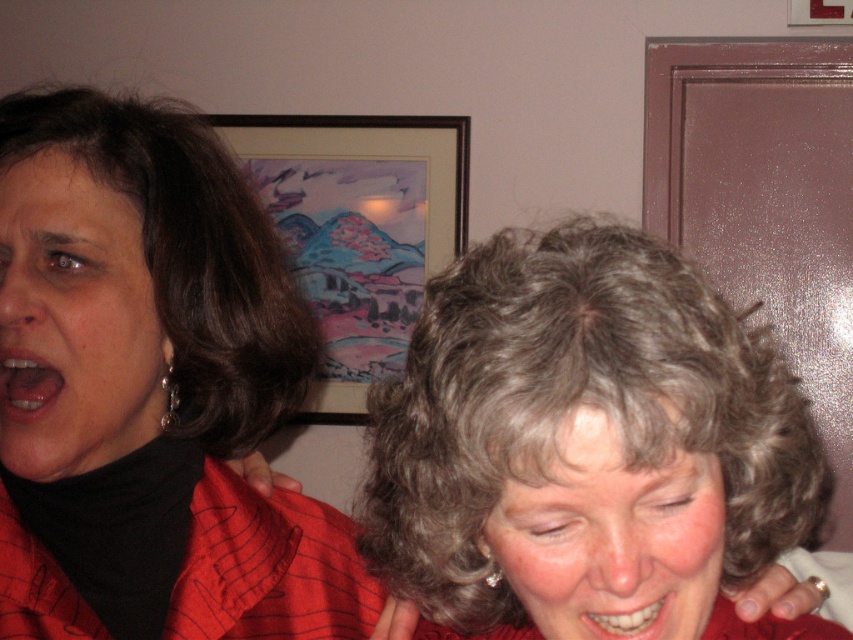
Question: Is gray curly hair at center below wooden framed artwork at upper center?

Choices:
 (A) yes
 (B) no

Answer: (A)

Question: Which object appears farthest from the camera in this image?

Choices:
 (A) wooden framed artwork at upper center
 (B) gray curly hair at center

Answer: (A)

Question: Among these points, which one is farthest from the camera?

Choices:
 (A) (39, 356)
 (B) (412, 429)
 (C) (108, 428)

Answer: (C)

Question: Observing the image, what is the correct spatial positioning of matte black shirt at left in reference to smooth skin face at center?

Choices:
 (A) above
 (B) below

Answer: (A)

Question: Which of the following is the closest to the observer?

Choices:
 (A) (62, 376)
 (B) (579, 356)
 (C) (223, 124)
 (D) (610, 595)

Answer: (B)

Question: Is matte black shirt at left positioned at the back of smooth skin face at center?

Choices:
 (A) no
 (B) yes

Answer: (B)